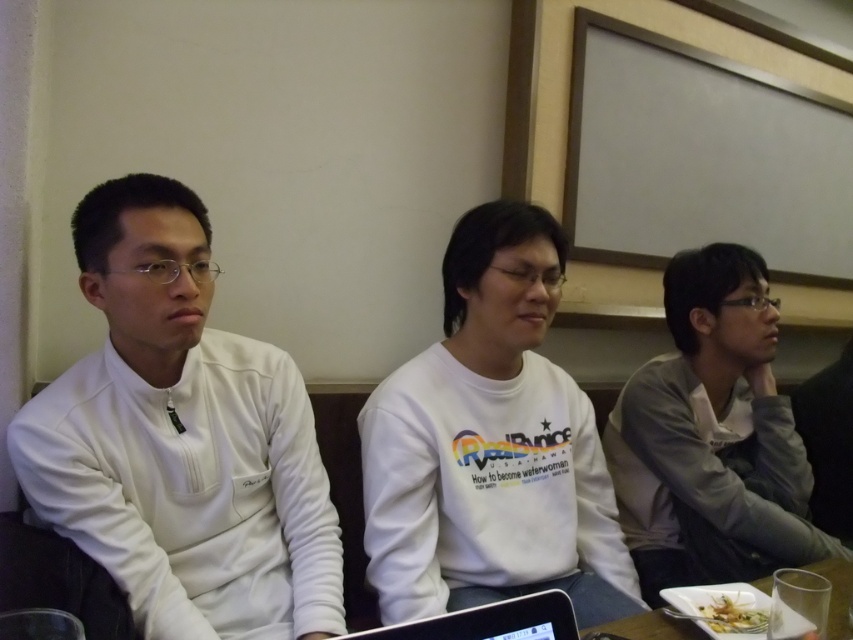
You are trying to see the screen of the black glossy laptop at center without moving your position. Can you see it from where you are standing, considering the white matte sweatshirt at left is in front of it?

The black glossy laptop at center is behind the white matte sweatshirt at left, so you cannot see the screen of the black glossy laptop at center from your current position because the white matte sweatshirt at left is blocking the view.

You are a photographer setting up a shot of the scene. You need to ensure that the white matte sweatshirt at left is visible above the green leafy salad at lower right. Is this already the case in the current arrangement?

Yes, the white matte sweatshirt at left is already positioned above the green leafy salad at lower right, so it is visible as required.

You are standing in the room and want to move from the point at coordinates point (115, 464) to the point at coordinates point (491, 604). Which direction should you move in to reach the second point?

To move from point (115, 464) to point (491, 604), you should move towards the right and upwards since the second point has a higher x and y coordinate than the first point.